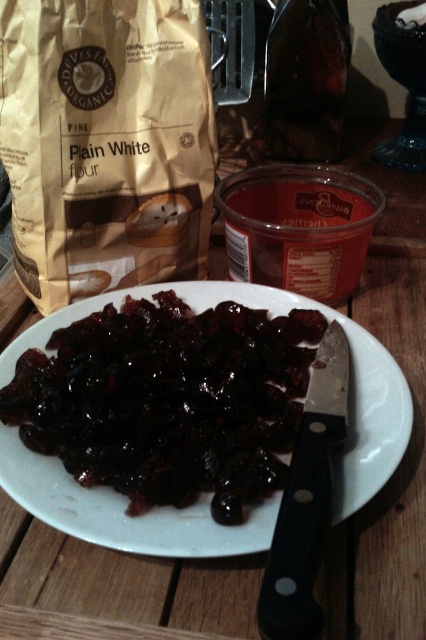
Is point (129, 20) farther from camera compared to point (226, 419)?

Yes, it is behind point (226, 419).

Which is below, brown paper bag at upper left or shiny dark brown raisins at center?

shiny dark brown raisins at center is lower down.

What do you see at coordinates (106, 141) in the screenshot? The image size is (426, 640). I see `brown paper bag at upper left` at bounding box center [106, 141].

Locate an element on the screen. The height and width of the screenshot is (640, 426). brown paper bag at upper left is located at coordinates (106, 141).